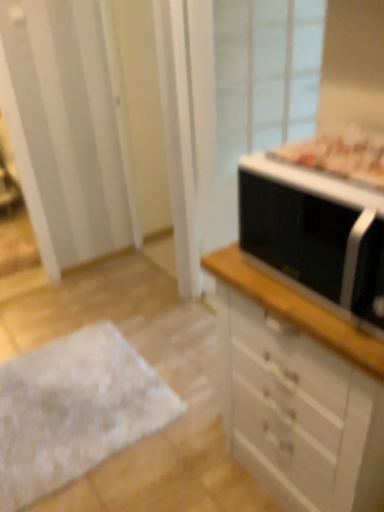
What do you see at coordinates (299, 392) in the screenshot? I see `white glossy chest of drawers at right` at bounding box center [299, 392].

Where is `white fluffy rug at lower left`? white fluffy rug at lower left is located at coordinates (74, 410).

Identify the location of white glossy chest of drawers at right. (299, 392).

Find the location of a particular element. The image size is (384, 512). screen door located on the left of black matte microwave at right is located at coordinates (247, 93).

Does point (301, 217) come farther from viewer compared to point (228, 111)?

No, it is in front of (228, 111).

Is black matte microwave at right beside transparent glass screen door at upper right?

black matte microwave at right is not next to transparent glass screen door at upper right, and they're not touching.

Considering the positions of points (220, 311) and (272, 197), is point (220, 311) farther from camera compared to point (272, 197)?

Yes.

Find the location of a particular element. This screenshot has width=384, height=512. chest of drawers below the black matte microwave at right (from a real-world perspective) is located at coordinates (299, 392).

How much distance is there between white glossy chest of drawers at right and black matte microwave at right?

They are 10.76 inches apart.

Considering the sizes of objects white glossy chest of drawers at right and black matte microwave at right in the image provided, who is bigger, white glossy chest of drawers at right or black matte microwave at right?

Bigger between the two is white glossy chest of drawers at right.

How different are the orientations of white fluffy rug at lower left and white glossy chest of drawers at right in degrees?

87.4 degrees separate the facing orientations of white fluffy rug at lower left and white glossy chest of drawers at right.

In the image, is white fluffy rug at lower left on the left side or the right side of white glossy chest of drawers at right?

white fluffy rug at lower left is to the left of white glossy chest of drawers at right.

Does white fluffy rug at lower left have a greater height compared to white glossy chest of drawers at right?

No, white fluffy rug at lower left is not taller than white glossy chest of drawers at right.

How different are the orientations of transparent glass screen door at upper right and black matte microwave at right in degrees?

They differ by 79.7 degrees in their facing directions.

Does point (231, 92) appear closer or farther from the camera than point (293, 198)?

Point (231, 92) is farther from the camera than point (293, 198).

Is transparent glass screen door at upper right aimed at black matte microwave at right?

Yes.

From the image's perspective, is transparent glass screen door at upper right beneath black matte microwave at right?

No, from the image's perspective, transparent glass screen door at upper right is not beneath black matte microwave at right.

Does white fluffy rug at lower left have a greater width compared to black matte microwave at right?

Yes.

Considering the positions of point (130, 401) and point (319, 198), is point (130, 401) closer or farther from the camera than point (319, 198)?

Point (130, 401) is farther from the camera than point (319, 198).

Is there a large distance between white fluffy rug at lower left and black matte microwave at right?

Yes, white fluffy rug at lower left and black matte microwave at right are quite far apart.

Which is behind, black matte microwave at right or white glossy chest of drawers at right?

white glossy chest of drawers at right is further from the camera.

Which point is more distant from viewer, [256,208] or [377,426]?

The point [256,208] is farther.

Which of these two, black matte microwave at right or white glossy chest of drawers at right, is thinner?

Thinner between the two is black matte microwave at right.

From a real-world perspective, is black matte microwave at right under white glossy chest of drawers at right?

No, from a real-world perspective, black matte microwave at right is not below white glossy chest of drawers at right.

From the image's perspective, which is below, transparent glass screen door at upper right or white fluffy rug at lower left?

white fluffy rug at lower left is shown below in the image.

Does point (239, 138) appear closer or farther from the camera than point (86, 467)?

Clearly, point (239, 138) is more distant from the camera than point (86, 467).

From the picture: Can you tell me how much transparent glass screen door at upper right and white fluffy rug at lower left differ in facing direction?

The facing directions of transparent glass screen door at upper right and white fluffy rug at lower left are 9.26 degrees apart.

Measure the distance between transparent glass screen door at upper right and white fluffy rug at lower left.

They are 1.27 meters apart.

This screenshot has height=512, width=384. What are the coordinates of `microwave oven that is below the transparent glass screen door at upper right (from the image's perspective)` in the screenshot? It's located at (316, 234).

This screenshot has width=384, height=512. Find the location of `microwave oven above the white glossy chest of drawers at right (from a real-world perspective)`. microwave oven above the white glossy chest of drawers at right (from a real-world perspective) is located at coordinates (316, 234).

From the image, which object appears to be farther from white fluffy rug at lower left, black matte microwave at right or transparent glass screen door at upper right?

transparent glass screen door at upper right lies further to white fluffy rug at lower left than the other object.

Based on their spatial positions, is white glossy chest of drawers at right or black matte microwave at right further from transparent glass screen door at upper right?

Based on the image, black matte microwave at right appears to be further to transparent glass screen door at upper right.

Looking at the image, which one is located closer to white fluffy rug at lower left, transparent glass screen door at upper right or black matte microwave at right?

Based on the image, black matte microwave at right appears to be nearer to white fluffy rug at lower left.

Which object lies nearer to the anchor point white glossy chest of drawers at right, black matte microwave at right or transparent glass screen door at upper right?

black matte microwave at right.

Estimate the real-world distances between objects in this image. Which object is closer to transparent glass screen door at upper right, white glossy chest of drawers at right or white fluffy rug at lower left?

Among the two, white fluffy rug at lower left is located nearer to transparent glass screen door at upper right.

Estimate the real-world distances between objects in this image. Which object is closer to white glossy chest of drawers at right, white fluffy rug at lower left or transparent glass screen door at upper right?

white fluffy rug at lower left lies closer to white glossy chest of drawers at right than the other object.

Which object lies further to the anchor point white fluffy rug at lower left, white glossy chest of drawers at right or transparent glass screen door at upper right?

transparent glass screen door at upper right lies further to white fluffy rug at lower left than the other object.

Which object lies nearer to the anchor point white fluffy rug at lower left, white glossy chest of drawers at right or black matte microwave at right?

white glossy chest of drawers at right lies closer to white fluffy rug at lower left than the other object.

Find the location of a particular element. microwave oven between transparent glass screen door at upper right and white fluffy rug at lower left vertically is located at coordinates (316, 234).

Locate an element on the screen. Image resolution: width=384 pixels, height=512 pixels. microwave oven between white fluffy rug at lower left and white glossy chest of drawers at right is located at coordinates (316, 234).

The width and height of the screenshot is (384, 512). I want to click on the chest of drawers that lies between transparent glass screen door at upper right and white fluffy rug at lower left from top to bottom, so click(299, 392).

Locate an element on the screen. The width and height of the screenshot is (384, 512). the chest of drawers positioned between black matte microwave at right and transparent glass screen door at upper right from near to far is located at coordinates (299, 392).